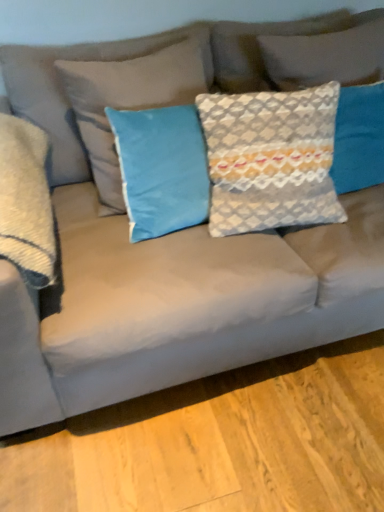
Question: From a real-world perspective, relative to textured gray pillow at center, the third pillow when ordered from left to right, is textured gray pillow at upper right, which is counted as the 4th pillow, starting from the left, vertically above or below?

Choices:
 (A) above
 (B) below

Answer: (A)

Question: Considering the relative positions of textured gray pillow at upper right, which is counted as the 4th pillow, starting from the left, and textured gray pillow at center, the third pillow when ordered from left to right, in the image provided, is textured gray pillow at upper right, which is counted as the 4th pillow, starting from the left, to the left or to the right of textured gray pillow at center, the third pillow when ordered from left to right,?

Choices:
 (A) left
 (B) right

Answer: (B)

Question: Which of these objects is positioned farthest from the textured gray pillow at center, the third pillow when ordered from left to right?

Choices:
 (A) textured gray pillow at upper right, which is counted as the 4th pillow, starting from the left
 (B) satin gray pillow at left, the fourth pillow positioned from the right
 (C) blue velvet pillow at center, marked as the 3th pillow in a right-to-left arrangement

Answer: (B)

Question: Which of these objects is positioned closest to the textured gray pillow at upper right, which is counted as the 4th pillow, starting from the left?

Choices:
 (A) blue velvet pillow at center, placed as the 2th pillow when sorted from left to right
 (B) satin gray pillow at left, the fourth pillow positioned from the right
 (C) textured gray pillow at center, the third pillow when ordered from left to right

Answer: (C)